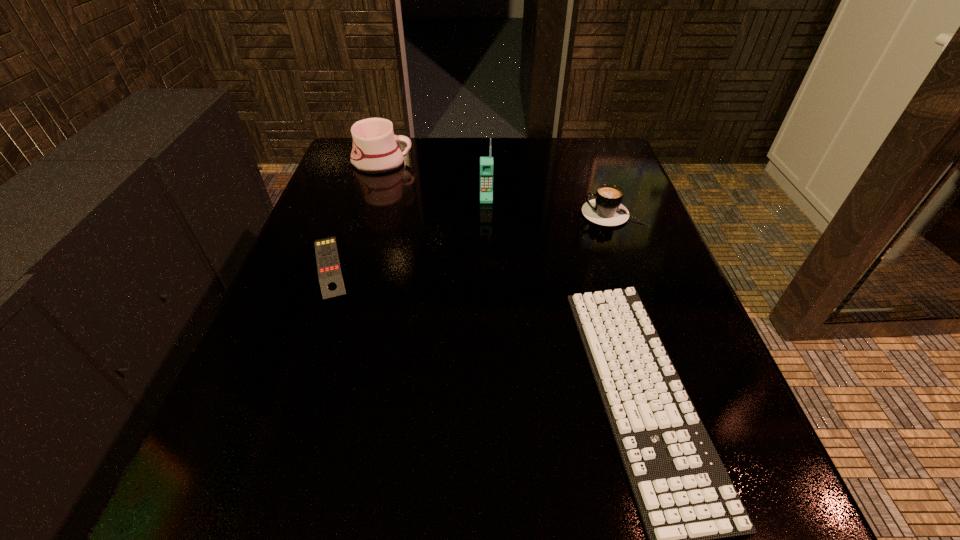
Select which object appears as the third closest to the mug. Please provide its 2D coordinates. Your answer should be formatted as a tuple, i.e. [(x, y)], where the tuple contains the x and y coordinates of a point satisfying the conditions above.

[(606, 209)]